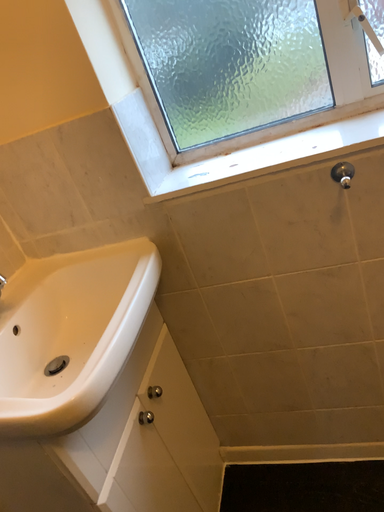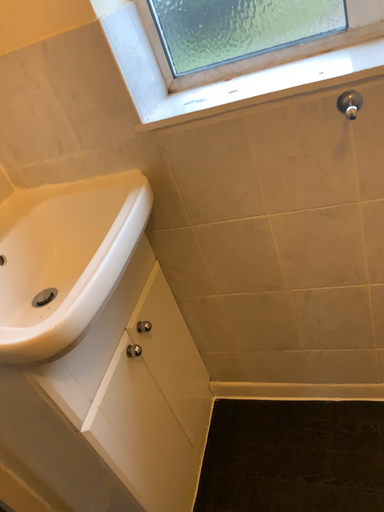
Question: Which way did the camera rotate in the video?

Choices:
 (A) rotated upward
 (B) rotated downward

Answer: (B)